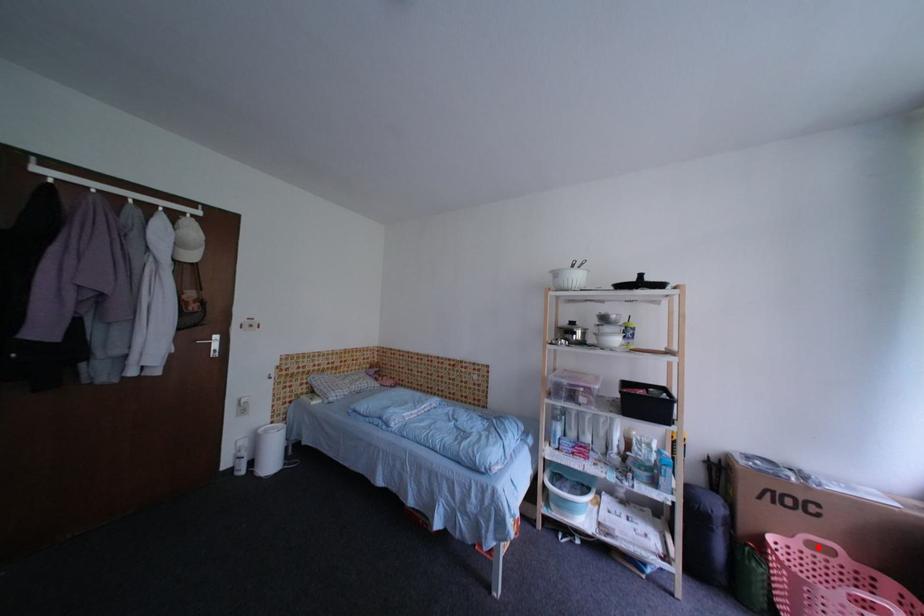
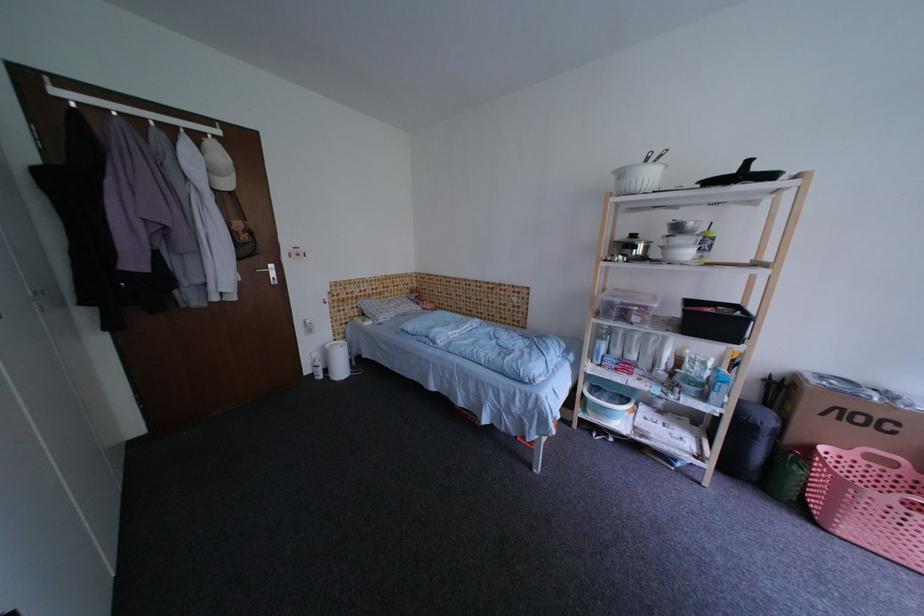
Question: A red point is marked in image1. In image2, is the corresponding 3D point closer to the camera or farther? Reply with the corresponding letter.

Choices:
 (A) The corresponding 3D point is closer.
 (B) The corresponding 3D point is farther.

Answer: (B)